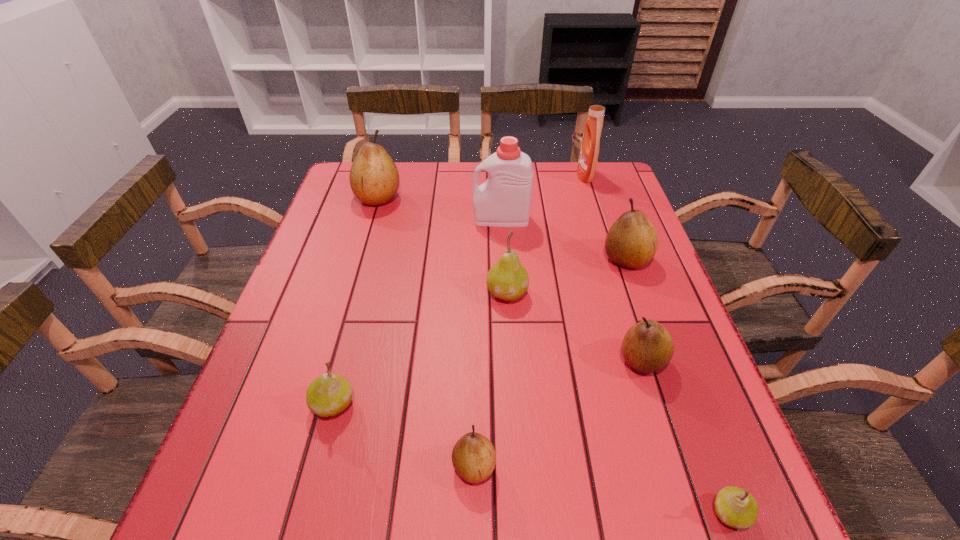
Locate an element on the screen. free spot located 0.200m on the handle side of the white detergent is located at coordinates (403, 219).

You are a GUI agent. You are given a task and a screenshot of the screen. Output one action in this format:
    pyautogui.click(x=<x>, y=<y>)
    Task: Click on the free space located 0.350m on the handle side of the white detergent
    The width and height of the screenshot is (960, 540).
    Given the screenshot: What is the action you would take?
    point(350,219)

I want to click on vacant area located 0.220m on the handle side of the white detergent, so click(396, 219).

You are a GUI agent. You are given a task and a screenshot of the screen. Output one action in this format:
    pyautogui.click(x=<x>, y=<y>)
    Task: Click on the free point located 0.090m on the front of the biggest brown pear
    The width and height of the screenshot is (960, 540).
    Given the screenshot: What is the action you would take?
    click(x=369, y=231)

Identify the location of vacant space situated on the left of the third nearest brown pear. (536, 259).

You are a GUI agent. You are given a task and a screenshot of the screen. Output one action in this format:
    pyautogui.click(x=<x>, y=<y>)
    Task: Click on the free location located on the front of the fifth nearest pear
    
    Given the screenshot: What is the action you would take?
    pyautogui.click(x=511, y=355)

I want to click on free point located 0.320m on the left of the second smallest brown pear, so click(463, 360).

This screenshot has height=540, width=960. I want to click on free space located 0.210m on the back of the second nearest green pear, so click(x=359, y=306).

At what (x,y) coordinates should I click in order to perform the action: click on blank area located 0.210m on the left of the smallest brown pear. Please return your answer as a coordinate pair (x, y). Looking at the image, I should click on (329, 466).

Where is `vacant area situated 0.350m on the back of the rightmost green pear`? vacant area situated 0.350m on the back of the rightmost green pear is located at coordinates (660, 327).